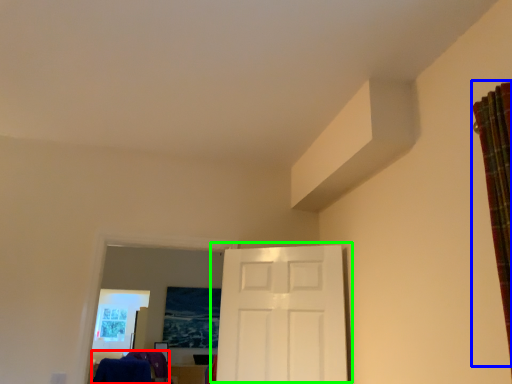
Question: Considering the real-world distances, which object is closest to laundry (highlighted by a red box)? curtain (highlighted by a blue box) or door (highlighted by a green box).

Choices:
 (A) curtain
 (B) door

Answer: (B)